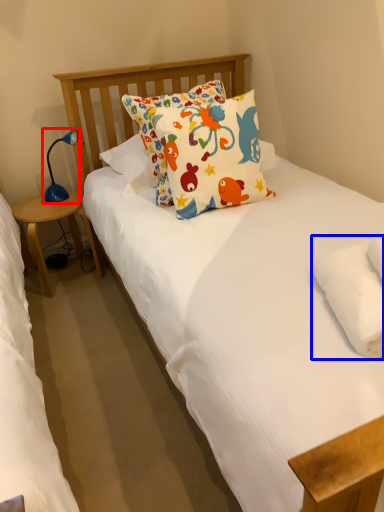
Question: Which of the following is the farthest to the observer, table lamp (highlighted by a red box) or pillow (highlighted by a blue box)?

Choices:
 (A) table lamp
 (B) pillow

Answer: (A)